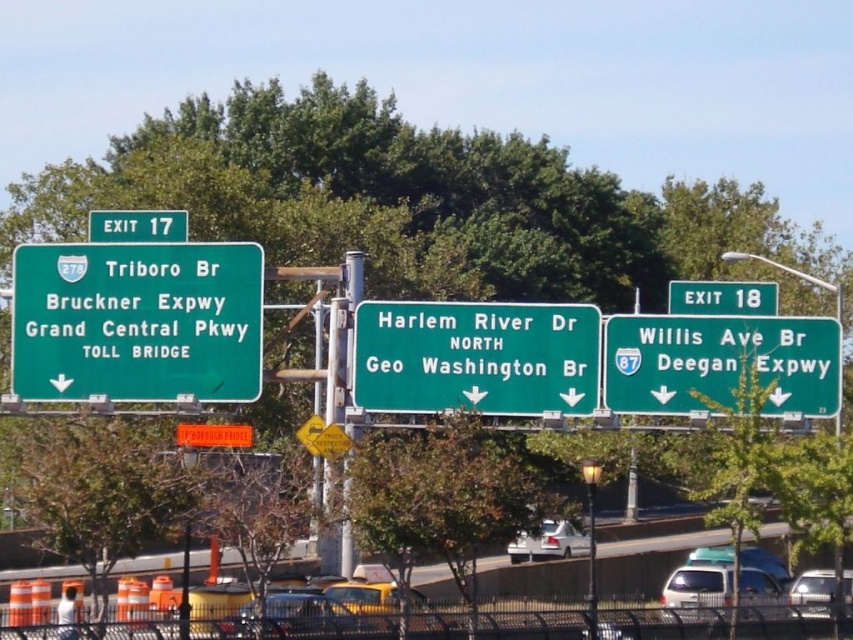
You are driving and need to decide whether to take the next exit. You notice a green metallic sign at right and a metallic pole at center. Which object is closer to you, the driver?

The green metallic sign at right is closer to you than the metallic pole at center because the metallic pole at center is behind the green metallic sign at right.

You are a driver approaching the highway exit signs. You need to determine if the green metallic sign at right is attached to the metallic pole at center. Based on the scene, can you confirm this?

The green metallic sign at right is positioned over metallic pole at center, so yes, it is attached to it.

Looking at this image, what is the exact coordinate of the green metallic sign at right?

The green metallic sign at right is located at point (722, 298).